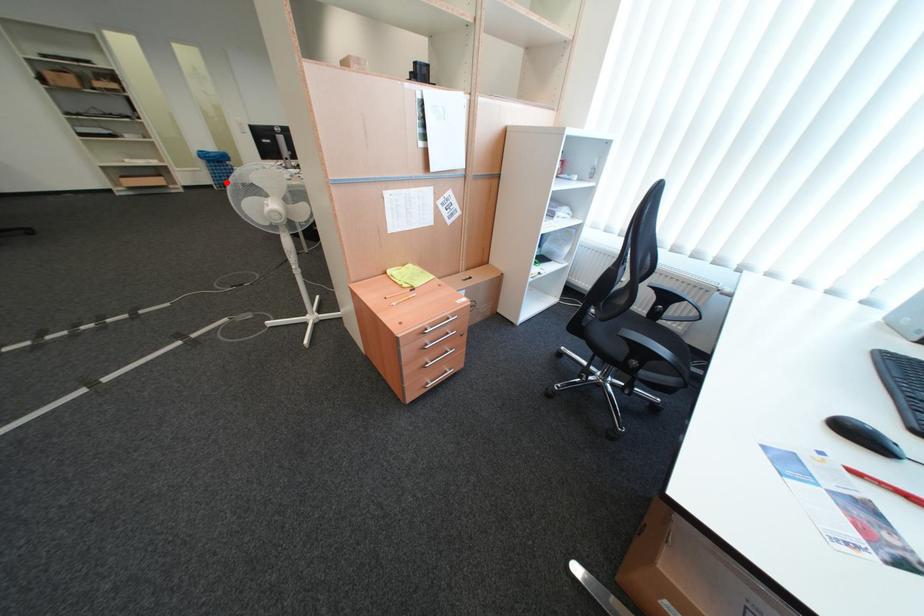
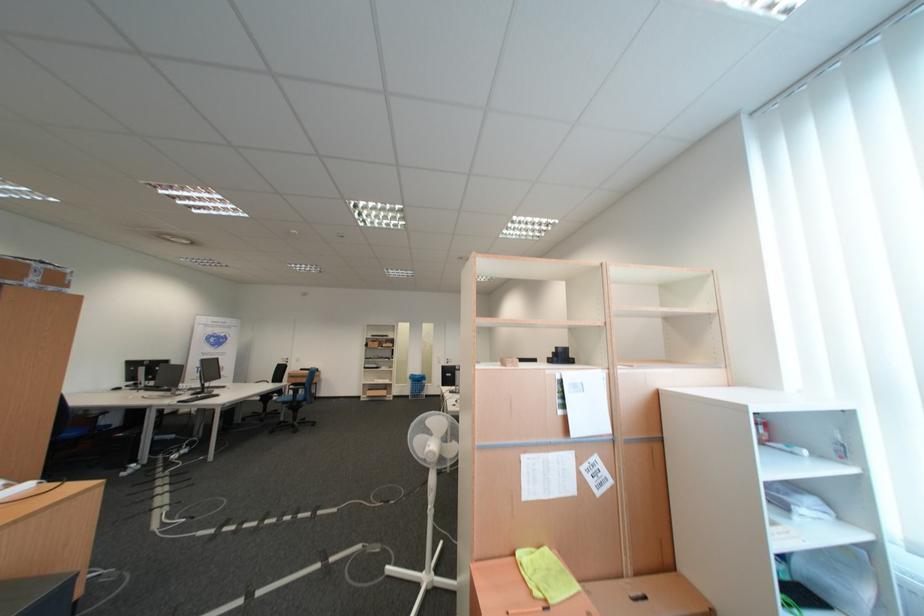
Where in the second image is the point corresponding to the highlighted location from the first image?

(422, 394)